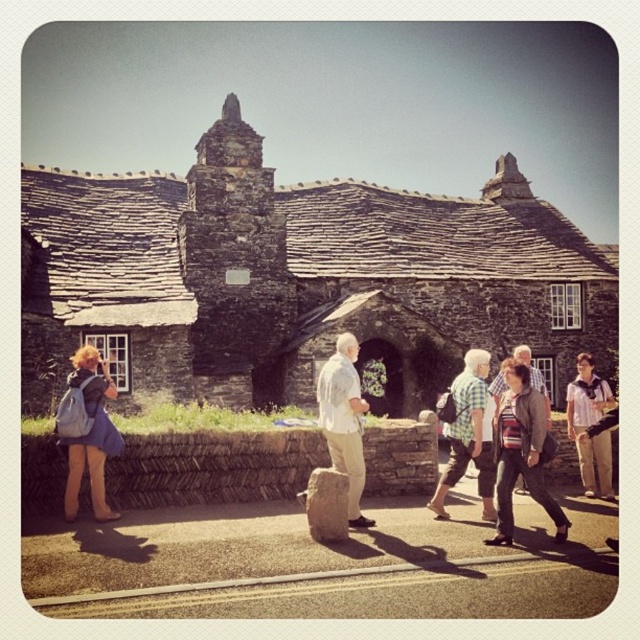
You are standing at the entrance of the historic stone building and notice a person wearing a white cotton shirt at center. If you want to approach them, in which direction should you walk relative to the building?

The white cotton shirt at center is located at point 0.658 on the x and 0.539 on the y coordinate. Since the entrance is in the center of the building, you should walk towards the center area of the building to reach the person wearing the white cotton shirt at center.

You are a photographer trying to capture both the striped knit sweater at center and the checkered fabric shirt at center in the same frame. Which direction should you move your camera to include both?

To include both the striped knit sweater at center and the checkered fabric shirt at center in the same frame, move your camera to the left since the striped knit sweater at center is to the right of the checkered fabric shirt at center.